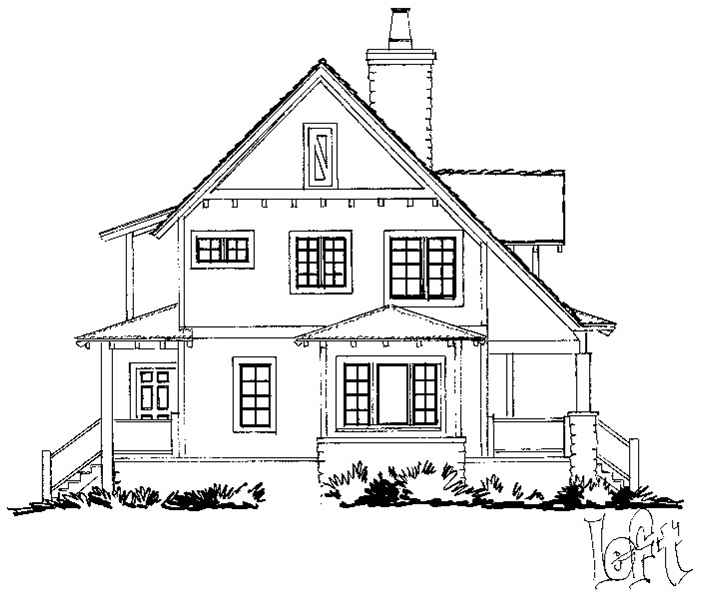
Image resolution: width=725 pixels, height=600 pixels. In order to click on door in this screenshot , I will do `click(392, 397)`.